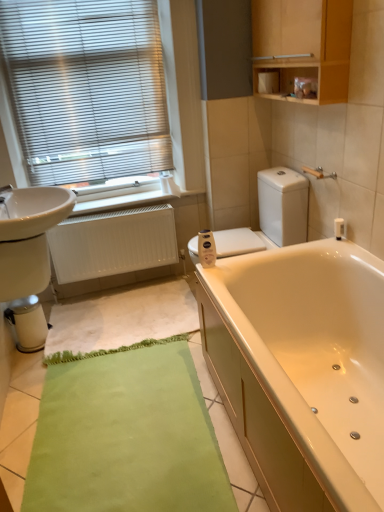
Question: Considering the relative sizes of metallic blinds at upper left and white glossy toilet at center in the image provided, is metallic blinds at upper left taller than white glossy toilet at center?

Choices:
 (A) no
 (B) yes

Answer: (B)

Question: Is metallic blinds at upper left shorter than white glossy toilet at center?

Choices:
 (A) no
 (B) yes

Answer: (A)

Question: Does metallic blinds at upper left have a larger size compared to white glossy toilet at center?

Choices:
 (A) no
 (B) yes

Answer: (A)

Question: Is metallic blinds at upper left in front of white glossy toilet at center?

Choices:
 (A) yes
 (B) no

Answer: (B)

Question: From the image's perspective, is metallic blinds at upper left above white glossy toilet at center?

Choices:
 (A) no
 (B) yes

Answer: (B)

Question: Does point [64, 100] appear closer or farther from the camera than point [43, 331]?

Choices:
 (A) closer
 (B) farther

Answer: (B)

Question: Is metallic blinds at upper left inside or outside of metallic silver water heater at lower left?

Choices:
 (A) inside
 (B) outside

Answer: (B)

Question: Is metallic blinds at upper left taller or shorter than metallic silver water heater at lower left?

Choices:
 (A) tall
 (B) short

Answer: (A)

Question: Looking at their shapes, would you say metallic blinds at upper left is wider or thinner than metallic silver water heater at lower left?

Choices:
 (A) thin
 (B) wide

Answer: (A)

Question: Is white textured bath mat at lower center inside the boundaries of metallic silver water heater at lower left, or outside?

Choices:
 (A) outside
 (B) inside

Answer: (A)

Question: Relative to metallic silver water heater at lower left, is white textured bath mat at lower center in front or behind?

Choices:
 (A) front
 (B) behind

Answer: (A)

Question: In terms of height, does white textured bath mat at lower center look taller or shorter compared to metallic silver water heater at lower left?

Choices:
 (A) tall
 (B) short

Answer: (B)

Question: From the image's perspective, is white textured bath mat at lower center located above or below metallic silver water heater at lower left?

Choices:
 (A) below
 (B) above

Answer: (B)

Question: In terms of size, does metallic blinds at upper left appear bigger or smaller than white glossy toilet at center?

Choices:
 (A) big
 (B) small

Answer: (B)

Question: Is metallic blinds at upper left situated inside white glossy toilet at center or outside?

Choices:
 (A) outside
 (B) inside

Answer: (A)